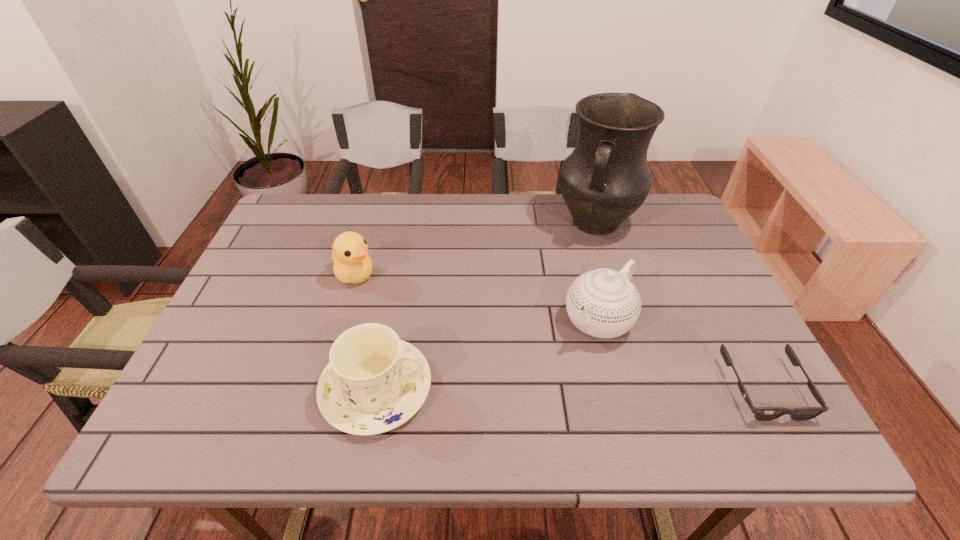
Where is `free spot on the desktop that is between the left chinaware and the shortest object and is positioned on the spout of the right chinaware`? free spot on the desktop that is between the left chinaware and the shortest object and is positioned on the spout of the right chinaware is located at coordinates (531, 388).

Locate an element on the screen. This screenshot has width=960, height=540. free spot on the desktop that is between the shorter chinaware and the sunglasses and is positioned on the face of the duck is located at coordinates (542, 388).

Where is `vacant spot on the desktop that is between the shorter chinaware and the rightmost object and is positioned on the handle side of the farthest object`? vacant spot on the desktop that is between the shorter chinaware and the rightmost object and is positioned on the handle side of the farthest object is located at coordinates (521, 388).